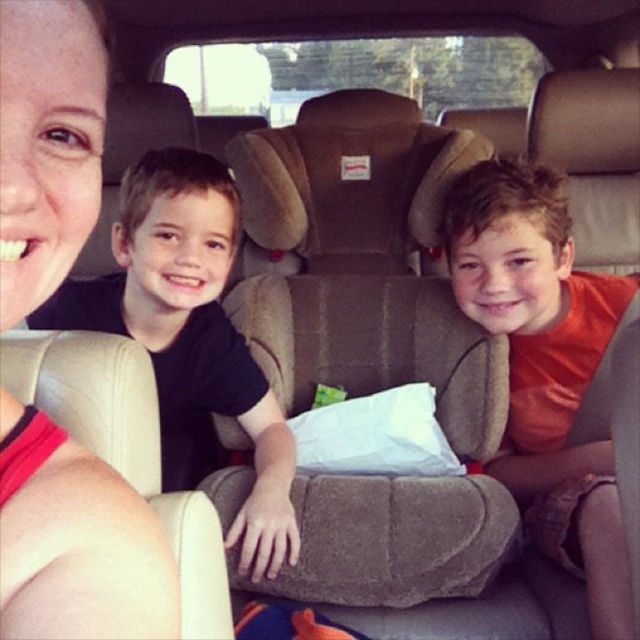
Question: Does orange cotton shirt at center have a lesser width compared to black matte shirt at center?

Choices:
 (A) no
 (B) yes

Answer: (B)

Question: Is matte pink tank top at upper left bigger than black matte shirt at center?

Choices:
 (A) yes
 (B) no

Answer: (B)

Question: Which object is positioned closest to the matte pink tank top at upper left?

Choices:
 (A) orange cotton shirt at center
 (B) black matte shirt at center

Answer: (B)

Question: Among these objects, which one is nearest to the camera?

Choices:
 (A) orange cotton shirt at center
 (B) black matte shirt at center

Answer: (A)

Question: Estimate the real-world distances between objects in this image. Which object is farther from the matte pink tank top at upper left?

Choices:
 (A) black matte shirt at center
 (B) orange cotton shirt at center

Answer: (B)

Question: Can you confirm if matte pink tank top at upper left is positioned to the right of orange cotton shirt at center?

Choices:
 (A) yes
 (B) no

Answer: (B)